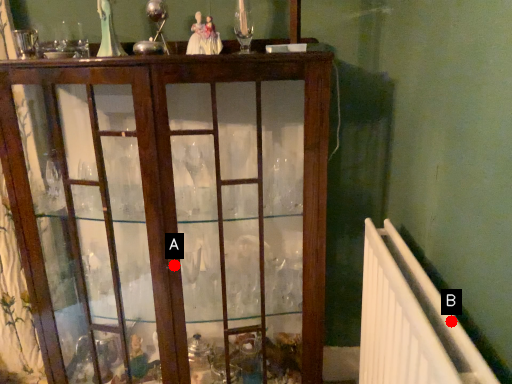
Question: Two points are circled on the image, labeled by A and B beside each circle. Which point is farther from the camera taking this photo?

Choices:
 (A) A is further
 (B) B is further

Answer: (A)